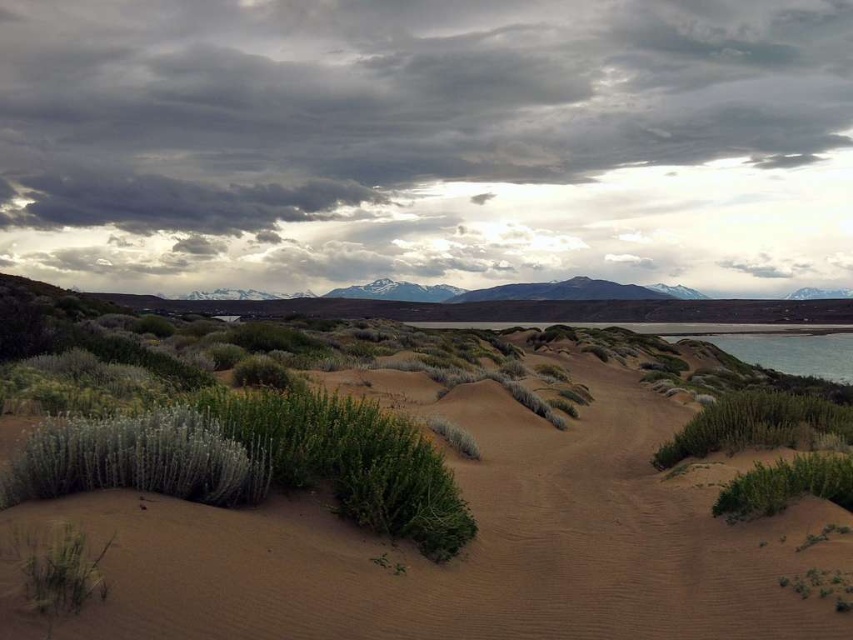
Which is behind, point (566, 477) or point (683, 458)?

The point (683, 458) is more distant.

Which of these two, sandy/dry sand at lower center or green leafy bush at lower right, stands taller?

green leafy bush at lower right

You are a GUI agent. You are given a task and a screenshot of the screen. Output one action in this format:
    pyautogui.click(x=<x>, y=<y>)
    Task: Click on the sandy/dry sand at lower center
    
    Given the screenshot: What is the action you would take?
    pyautogui.click(x=462, y=550)

Find the location of `sandy/dry sand at lower center`. sandy/dry sand at lower center is located at coordinates (462, 550).

Does point (152, 435) lie behind point (781, 390)?

No, it is in front of (781, 390).

What do you see at coordinates (138, 458) in the screenshot? The height and width of the screenshot is (640, 853). I see `green fuzzy bush at lower left` at bounding box center [138, 458].

Is point (161, 440) farther from viewer compared to point (822, 413)?

No, it is in front of (822, 413).

Where is `green fuzzy bush at lower left`? The image size is (853, 640). green fuzzy bush at lower left is located at coordinates (138, 458).

Image resolution: width=853 pixels, height=640 pixels. Describe the element at coordinates (462, 550) in the screenshot. I see `sandy/dry sand at lower center` at that location.

Consider the image. Can you confirm if sandy/dry sand at lower center is wider than green leafy bush at lower left?

Yes, sandy/dry sand at lower center is wider than green leafy bush at lower left.

Which is behind, point (624, 605) or point (48, 557)?

Point (624, 605)

The height and width of the screenshot is (640, 853). I want to click on sandy/dry sand at lower center, so click(462, 550).